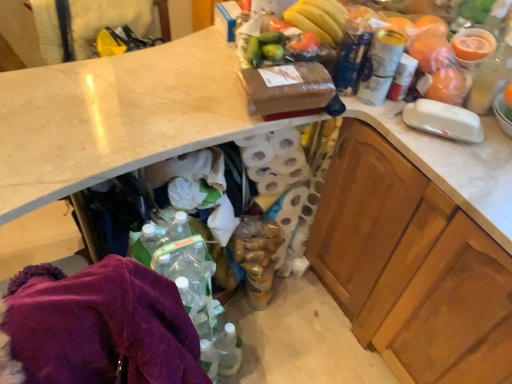
Question: Does point (270, 145) appear closer or farther from the camera than point (373, 69)?

Choices:
 (A) farther
 (B) closer

Answer: (A)

Question: From the image's perspective, relative to metallic silver can at upper right, which is the first bottle from left to right, is white textured toilet paper at center above or below?

Choices:
 (A) above
 (B) below

Answer: (B)

Question: Based on their relative distances, which object is farther from the wooden cabinet at right?

Choices:
 (A) yellow matte bananas at upper right
 (B) metallic silver can at upper right, arranged as the second bottle when viewed from the right
 (C) translucent plastic cup at upper right, arranged as the 1th bottle when viewed from the right
 (D) white marble countertop at lower left
 (E) white textured toilet paper at center

Answer: (A)

Question: Which is nearer to the white marble countertop at lower left?

Choices:
 (A) metallic silver can at upper right, which is the first bottle from left to right
 (B) translucent plastic cup at upper right, which is counted as the 2th bottle, starting from the left
 (C) yellow matte bananas at upper right
 (D) wooden cabinet at right
 (E) white textured toilet paper at center

Answer: (E)